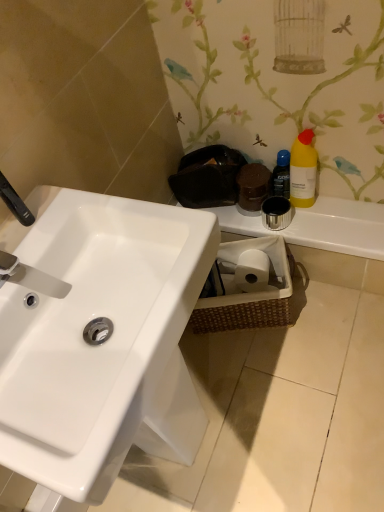
At what (x,y) coordinates should I click in order to perform the action: click on vacant space underneath white glossy sink at center (from a real-world perspective). Please return your answer as a coordinate pair (x, y). Looking at the image, I should click on (201, 449).